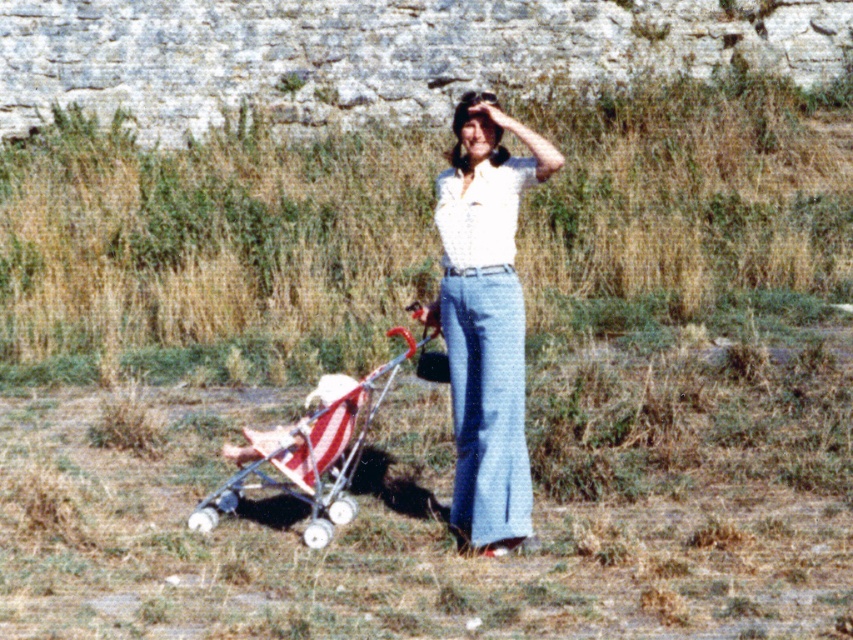
Question: Can you confirm if white cotton blouse at center is positioned to the right of red striped fabric stroller at lower left?

Choices:
 (A) no
 (B) yes

Answer: (B)

Question: Does white cotton blouse at center have a lesser width compared to red and white striped fabric stroller at lower left?

Choices:
 (A) yes
 (B) no

Answer: (A)

Question: Which of the following is the farthest from the observer?

Choices:
 (A) (277, 486)
 (B) (332, 374)

Answer: (B)

Question: Can you confirm if red striped fabric stroller at lower left is bigger than red and white striped fabric stroller at lower left?

Choices:
 (A) yes
 (B) no

Answer: (A)

Question: Among these objects, which one is farthest from the camera?

Choices:
 (A) red and white striped fabric stroller at lower left
 (B) red striped fabric stroller at lower left

Answer: (A)

Question: Which point is closer to the camera?

Choices:
 (A) (328, 529)
 (B) (276, 435)

Answer: (A)